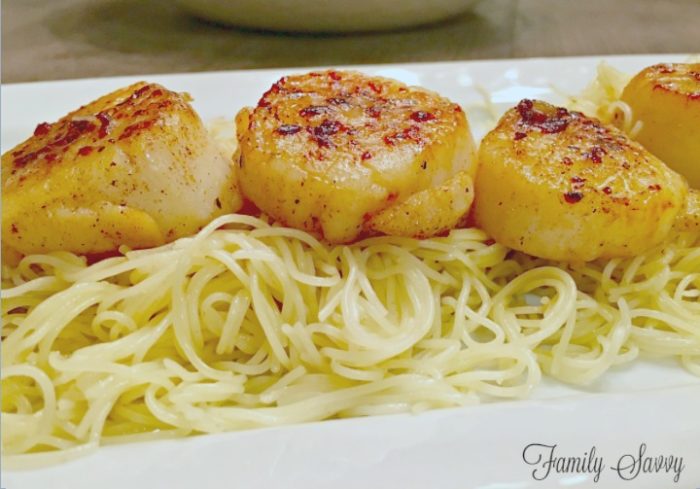
Locate an element on the screen. plate is located at coordinates (414, 430), (483, 82).